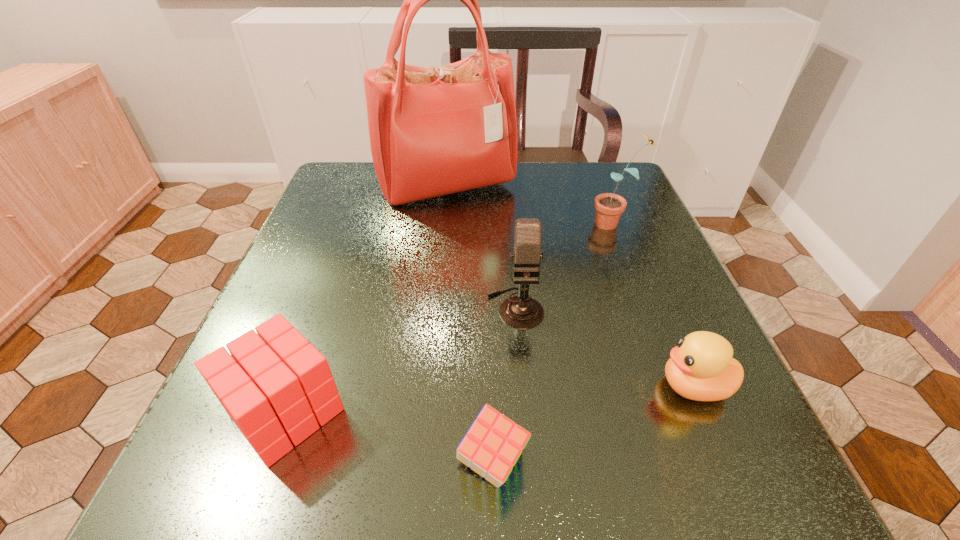
Locate an element on the screen. sunflower located in the right edge section of the desktop is located at coordinates (609, 206).

Find the location of a particular element. Image resolution: width=960 pixels, height=540 pixels. duckling that is at the right edge is located at coordinates tap(701, 368).

You are a GUI agent. You are given a task and a screenshot of the screen. Output one action in this format:
    pyautogui.click(x=<x>, y=<y>)
    Task: Click on the object at the far left corner
    The width and height of the screenshot is (960, 540).
    Given the screenshot: What is the action you would take?
    pyautogui.click(x=433, y=131)

Locate an element on the screen. This screenshot has height=540, width=960. object present at the near left corner is located at coordinates (275, 386).

This screenshot has width=960, height=540. In order to click on vacant area at the far edge of the desktop in this screenshot , I will do `click(502, 197)`.

The width and height of the screenshot is (960, 540). What are the coordinates of `vacant point at the near edge` in the screenshot? It's located at (644, 461).

Identify the location of free space at the left edge of the desktop. (360, 235).

Image resolution: width=960 pixels, height=540 pixels. In order to click on free point at the right edge in this screenshot , I will do `click(646, 354)`.

Where is `vacant region at the near left corner of the desktop`? The height and width of the screenshot is (540, 960). vacant region at the near left corner of the desktop is located at coordinates click(x=287, y=495).

Image resolution: width=960 pixels, height=540 pixels. In the image, there is a desktop. Identify the location of free space at the far right corner. (588, 161).